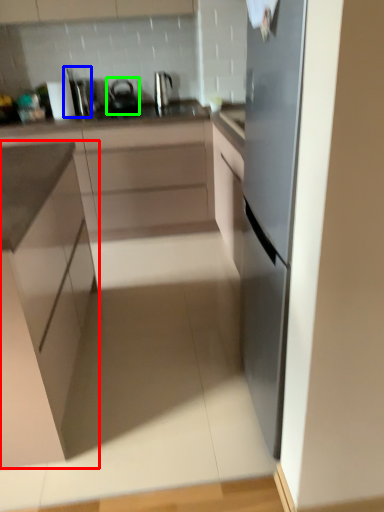
Question: Which is farther away from cabinetry (highlighted by a red box)? appliance (highlighted by a blue box) or tea pot (highlighted by a green box)?

Choices:
 (A) appliance
 (B) tea pot

Answer: (A)